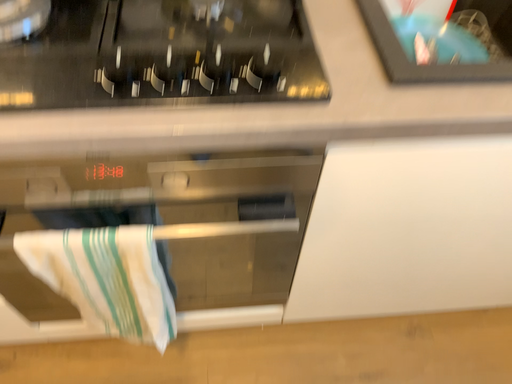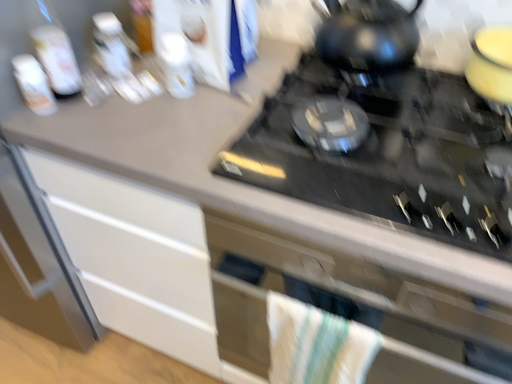
Question: Which way did the camera rotate in the video?

Choices:
 (A) rotated upward
 (B) rotated downward

Answer: (A)